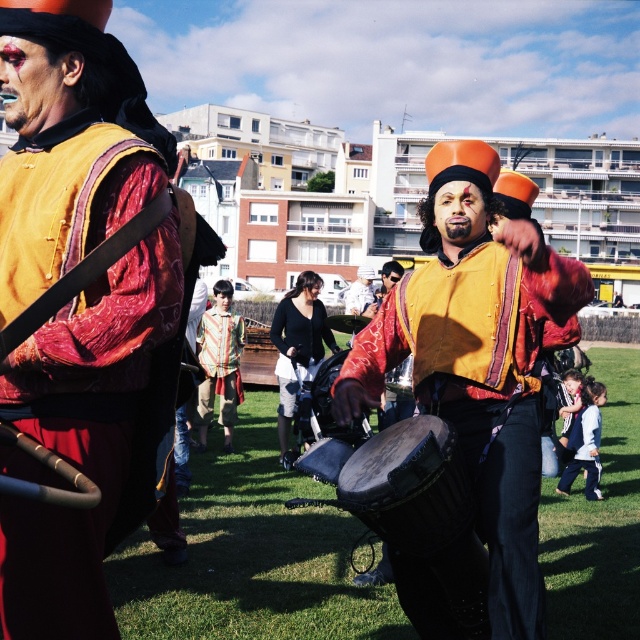
Does smooth brown drum at center have a lesser height compared to blue denim jacket at lower right?

No.

Where is `smooth brown drum at center`? Image resolution: width=640 pixels, height=640 pixels. smooth brown drum at center is located at coordinates (326, 426).

Who is more forward, (342, 428) or (596, 442)?

Point (342, 428)

I want to click on smooth brown drum at center, so click(x=326, y=426).

Can you confirm if black cotton shirt at center is positioned to the left of striped fabric shirt at center?

In fact, black cotton shirt at center is to the right of striped fabric shirt at center.

Where is `black cotton shirt at center`? The image size is (640, 640). black cotton shirt at center is located at coordinates (298, 342).

Is point (300, 330) closer to camera compared to point (209, 390)?

Yes, it is.

The width and height of the screenshot is (640, 640). What are the coordinates of `black cotton shirt at center` in the screenshot? It's located at (298, 342).

What do you see at coordinates (394, 406) in the screenshot? The image size is (640, 640). I see `matte yellow vest at center` at bounding box center [394, 406].

Between matte yellow vest at center and smooth wooden drum at center, which one is positioned higher?

matte yellow vest at center is higher up.

Is point (410, 394) less distant than point (408, 369)?

Yes, it is.

Image resolution: width=640 pixels, height=640 pixels. I want to click on matte yellow vest at center, so click(x=394, y=406).